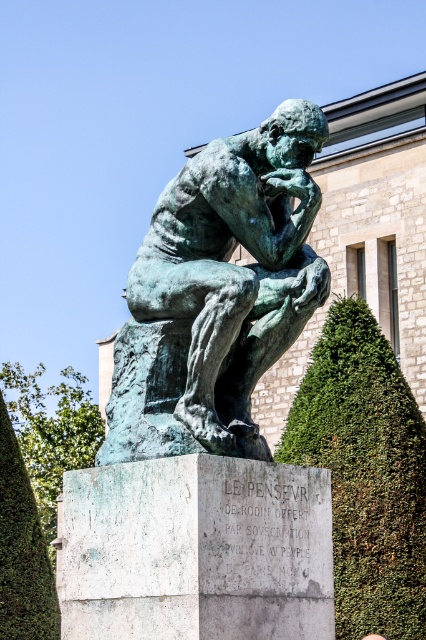
Question: Among these points, which one is farthest from the camera?

Choices:
 (A) (382, 436)
 (B) (6, 593)
 (C) (310, 109)

Answer: (B)

Question: Which object is the farthest from the green textured hedge at center right?

Choices:
 (A) green patina statue at center
 (B) green leafy hedge at lower left

Answer: (A)

Question: Does green textured hedge at center right appear on the left side of green leafy hedge at lower left?

Choices:
 (A) yes
 (B) no

Answer: (B)

Question: Which of the following is the closest to the observer?

Choices:
 (A) (189, 353)
 (B) (411, 468)
 (C) (5, 598)

Answer: (A)

Question: Is green patina statue at center behind green textured hedge at center right?

Choices:
 (A) yes
 (B) no

Answer: (B)

Question: Does green textured hedge at center right have a lesser width compared to green leafy hedge at lower left?

Choices:
 (A) no
 (B) yes

Answer: (A)